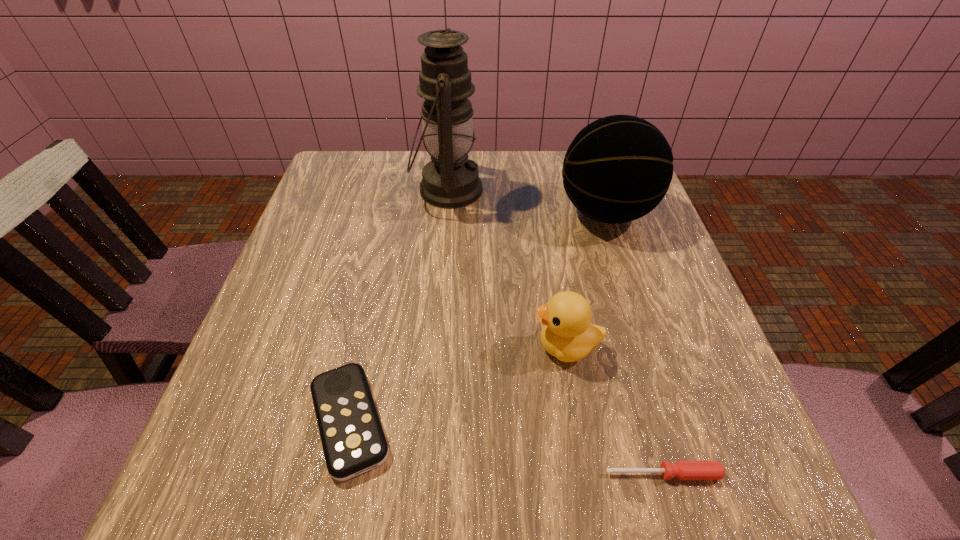
Locate an element on the screen. Image resolution: width=960 pixels, height=540 pixels. free point between the shortest object and the basketball is located at coordinates (635, 343).

Where is `vacant space that is in between the tallest object and the third shortest object`? The height and width of the screenshot is (540, 960). vacant space that is in between the tallest object and the third shortest object is located at coordinates (507, 268).

What are the coordinates of `free space between the oil lamp and the second shortest object` in the screenshot? It's located at (398, 305).

Image resolution: width=960 pixels, height=540 pixels. I want to click on free spot between the second shortest object and the screwdriver, so click(x=506, y=447).

This screenshot has height=540, width=960. In order to click on vacant point located between the basketball and the fourth tallest object in this screenshot , I will do `click(477, 317)`.

At what (x,y) coordinates should I click in order to perform the action: click on empty space between the second shortest object and the fourth shortest object. Please return your answer as a coordinate pair (x, y). Looking at the image, I should click on (477, 317).

Where is `blank region between the basketball and the oil lamp`? The height and width of the screenshot is (540, 960). blank region between the basketball and the oil lamp is located at coordinates (527, 201).

Select which object is the third closest to the basketball. Please provide its 2D coordinates. Your answer should be formatted as a tuple, i.e. [(x, y)], where the tuple contains the x and y coordinates of a point satisfying the conditions above.

[(353, 440)]

At what (x,y) coordinates should I click in order to perform the action: click on object identified as the closest to the tallest object. Please return your answer as a coordinate pair (x, y). The height and width of the screenshot is (540, 960). Looking at the image, I should click on (617, 169).

At what (x,y) coordinates should I click in order to perform the action: click on blank area in the image that satisfies the following two spatial constraints: 1. on the face of the duck; 2. on the right side of the screwdriver. Please return your answer as a coordinate pair (x, y). This screenshot has height=540, width=960. Looking at the image, I should click on (588, 474).